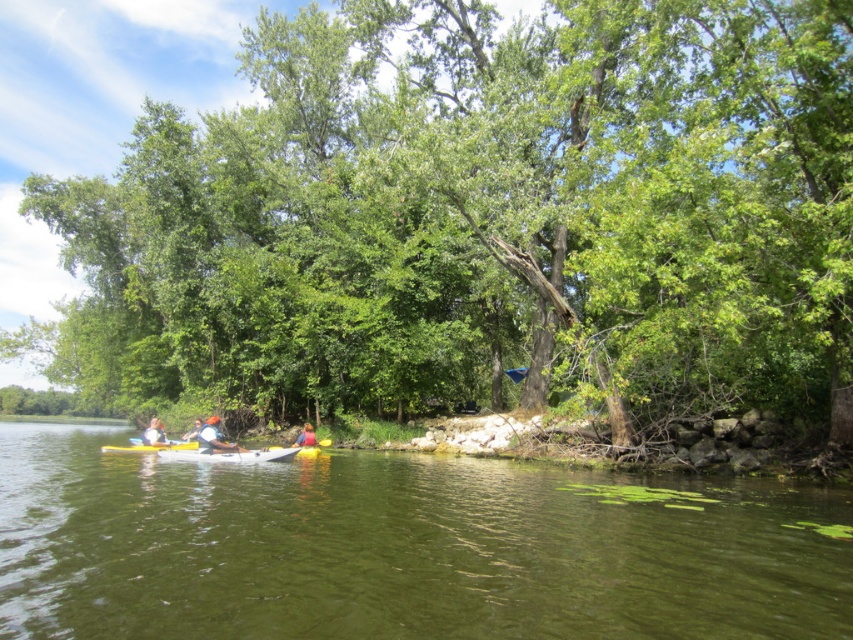
Question: Which point appears farthest from the camera in this image?

Choices:
 (A) (134, 634)
 (B) (192, 442)
 (C) (585, 141)
 (D) (192, 438)

Answer: (C)

Question: Can you confirm if white fabric kayak at lower left is smaller than white plastic kayak at center?

Choices:
 (A) no
 (B) yes

Answer: (A)

Question: Which point is farther to the camera?

Choices:
 (A) (228, 452)
 (B) (210, 449)

Answer: (A)

Question: Can you confirm if green smooth water at center is positioned below white plastic kayak at center?

Choices:
 (A) no
 (B) yes

Answer: (A)

Question: Can you confirm if green smooth water at center is positioned to the left of white fabric kayak at center?

Choices:
 (A) yes
 (B) no

Answer: (B)

Question: Which of the following is the closest to the observer?

Choices:
 (A) yellow plastic canoe at lower left
 (B) white plastic kayak at center
 (C) white fabric kayak at lower left

Answer: (A)